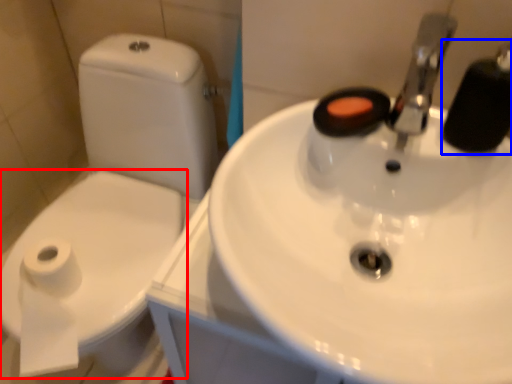
Question: Among these objects, which one is farthest to the camera, bidet (highlighted by a red box) or plumbing fixture (highlighted by a blue box)?

Choices:
 (A) bidet
 (B) plumbing fixture

Answer: (A)